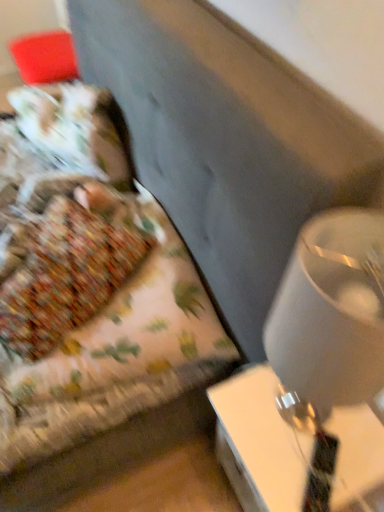
Locate an element on the screen. free spot below white glossy lampshade at right (from a real-world perspective) is located at coordinates (292, 413).